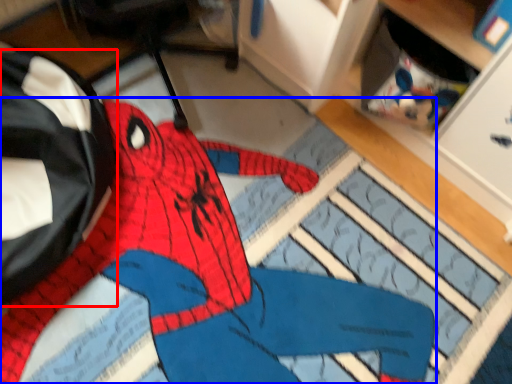
Question: Which object appears farthest to the camera in this image, messenger bag (highlighted by a red box) or person (highlighted by a blue box)?

Choices:
 (A) messenger bag
 (B) person

Answer: (A)